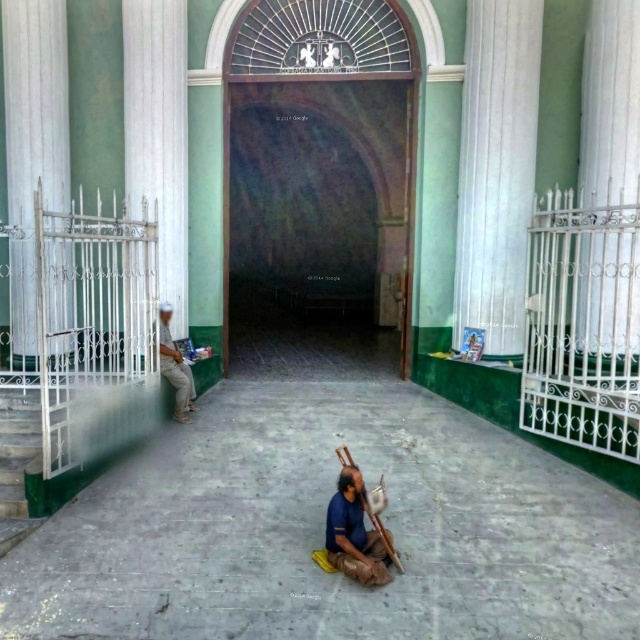
Who is shorter, white glossy pillar at left or white metal gate at left?

Standing shorter between the two is white metal gate at left.

You are a GUI agent. You are given a task and a screenshot of the screen. Output one action in this format:
    pyautogui.click(x=<x>, y=<y>)
    Task: Click on the white glossy pillar at left
    The image size is (640, 640).
    Given the screenshot: What is the action you would take?
    pyautogui.click(x=33, y=145)

Who is shorter, white metal gate at left or brown leather bag at center?

Standing shorter between the two is brown leather bag at center.

Can you confirm if white metal gate at left is taller than brown leather bag at center?

Indeed, white metal gate at left has a greater height compared to brown leather bag at center.

Locate an element on the screen. This screenshot has width=640, height=640. white metal gate at left is located at coordinates (157, 134).

Is white glossy pillar at left below brown leather bag at center?

Actually, white glossy pillar at left is above brown leather bag at center.

Image resolution: width=640 pixels, height=640 pixels. I want to click on white glossy pillar at left, so pos(33,145).

Where is `white glossy pillar at left`? white glossy pillar at left is located at coordinates (33, 145).

The height and width of the screenshot is (640, 640). In order to click on white glossy pillar at left in this screenshot , I will do [33, 145].